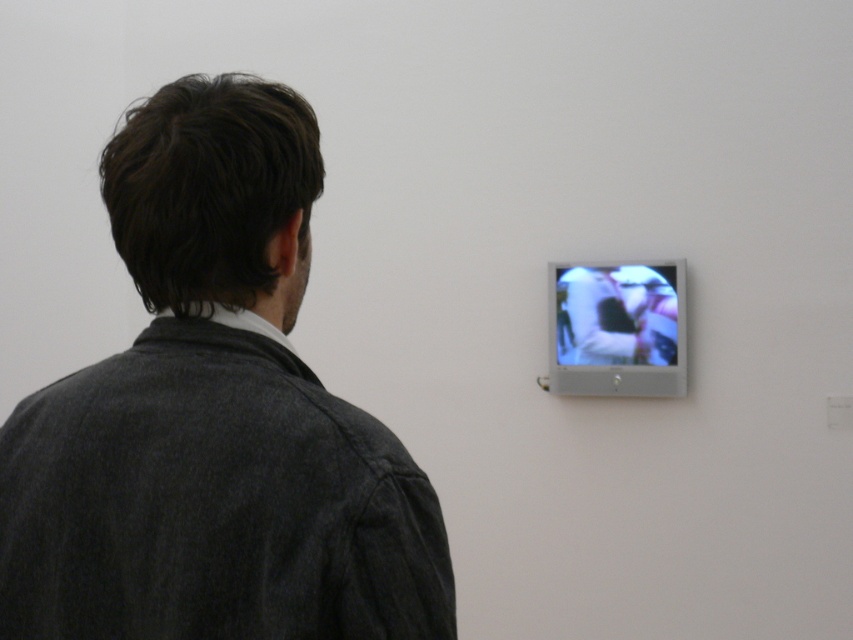
You are an art critic observing the scene. You notice the dark gray woolen jacket at center and the matte silver screen at upper right. Which object is positioned closer to you in this view?

The dark gray woolen jacket at center is closer to the viewer than the matte silver screen at upper right.

You are a security guard in an art gallery. You need to ensure that visitors maintain a minimum distance of 8 feet from the matte silver screen at upper right to prevent reflections. A visitor is wearing a dark gray woolen jacket at center. Are they currently within the required safety distance?

The dark gray woolen jacket at center is 8.31 feet from the matte silver screen at upper right. Since 8.31 feet is greater than the required 8 feet minimum distance, the visitor is within the safety guidelines and not too close to the screen.

You are an art curator assessing the layout of the exhibition space. You notice the dark gray woolen jacket at center and the matte silver screen at upper right. Which object occupies more space in the scene?

The dark gray woolen jacket at center occupies more space in the scene as it is bigger than the matte silver screen at upper right.